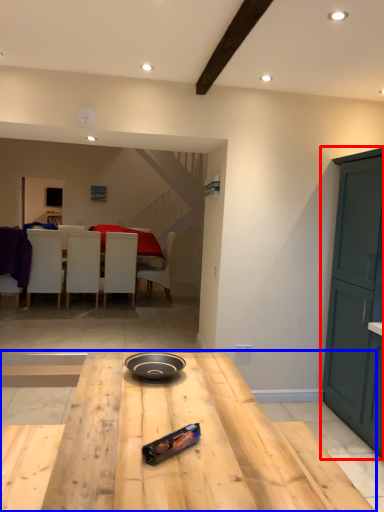
Question: Among these objects, which one is nearest to the camera, cabinetry (highlighted by a red box) or table (highlighted by a blue box)?

Choices:
 (A) cabinetry
 (B) table

Answer: (B)